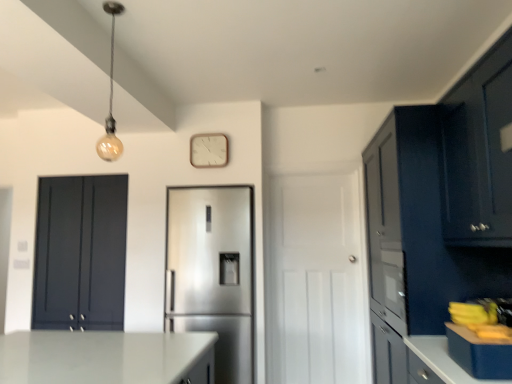
Image resolution: width=512 pixels, height=384 pixels. In order to click on free space above white matte door at center (from a real-world perspective) in this screenshot , I will do `click(314, 167)`.